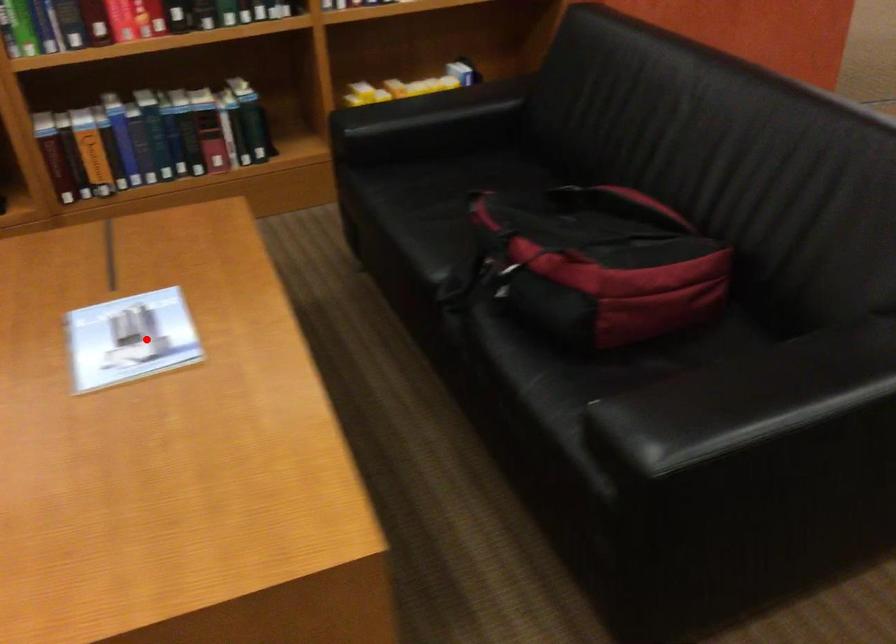
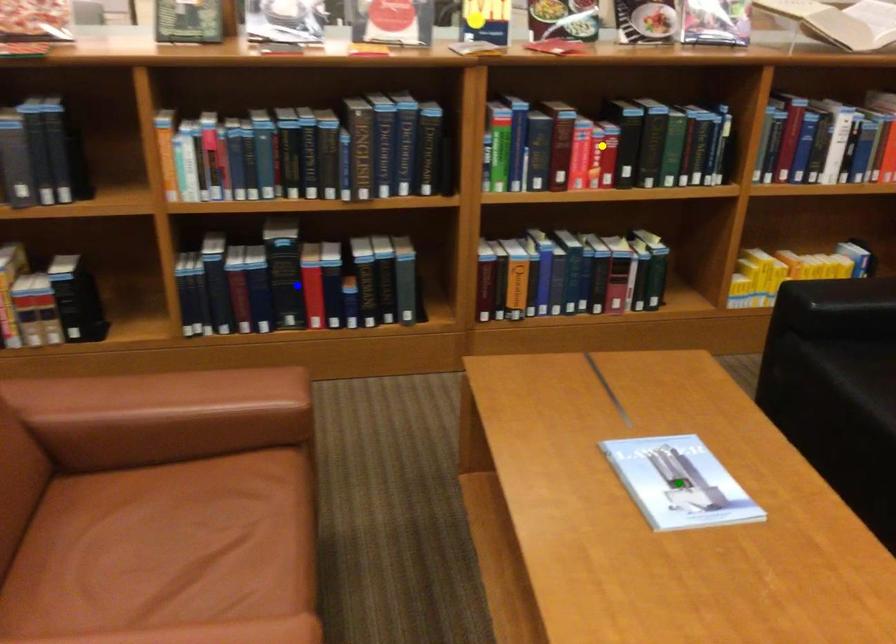
Question: I am providing you with two images of the same scene from different viewpoints. A red point is marked on the first image. You are given multiple points on the second image. Which spot in image 2 lines up with the point in image 1?

Choices:
 (A) green point
 (B) blue point
 (C) yellow point

Answer: (A)